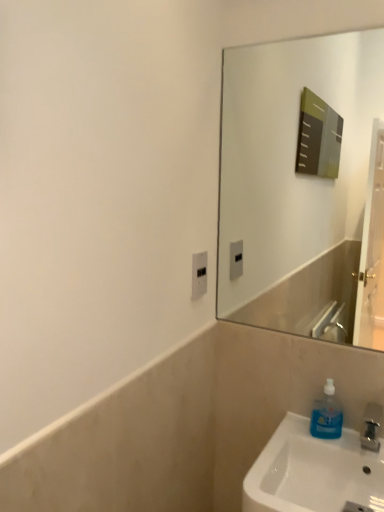
The width and height of the screenshot is (384, 512). Find the location of `white plastic electric outlet at center`. white plastic electric outlet at center is located at coordinates (199, 275).

What is the approximate width of white plastic electric outlet at center?

0.81 inches.

Describe the element at coordinates (199, 275) in the screenshot. Image resolution: width=384 pixels, height=512 pixels. I see `white plastic electric outlet at center` at that location.

The width and height of the screenshot is (384, 512). Describe the element at coordinates (327, 415) in the screenshot. I see `blue translucent soap dispenser at lower right` at that location.

In order to face blue translucent soap dispenser at lower right, should I rotate leftwards or rightwards?

You should rotate right by 17.493 degrees.

Locate an element on the screen. The height and width of the screenshot is (512, 384). blue translucent soap dispenser at lower right is located at coordinates (327, 415).

This screenshot has width=384, height=512. In order to click on white plastic electric outlet at center in this screenshot , I will do `click(199, 275)`.

Which is more to the right, blue translucent soap dispenser at lower right or white plastic electric outlet at center?

Positioned to the right is blue translucent soap dispenser at lower right.

Based on the photo, is blue translucent soap dispenser at lower right positioned before white plastic electric outlet at center?

Yes, blue translucent soap dispenser at lower right is closer to the viewer.

Is point (325, 402) farther from viewer compared to point (202, 287)?

No, it is in front of (202, 287).

From the image's perspective, is blue translucent soap dispenser at lower right positioned above or below white plastic electric outlet at center?

Based on their image positions, blue translucent soap dispenser at lower right is located beneath white plastic electric outlet at center.

From a real-world perspective, is blue translucent soap dispenser at lower right above or below white plastic electric outlet at center?

blue translucent soap dispenser at lower right is situated lower than white plastic electric outlet at center in the real world.

Which object is thinner, blue translucent soap dispenser at lower right or white plastic electric outlet at center?

With smaller width is white plastic electric outlet at center.

Does blue translucent soap dispenser at lower right have a lesser height compared to white plastic electric outlet at center?

No, blue translucent soap dispenser at lower right is not shorter than white plastic electric outlet at center.

Which of these two, blue translucent soap dispenser at lower right or white plastic electric outlet at center, is smaller?

With smaller size is white plastic electric outlet at center.

Would you say blue translucent soap dispenser at lower right is outside white plastic electric outlet at center?

Indeed, blue translucent soap dispenser at lower right is completely outside white plastic electric outlet at center.

Is blue translucent soap dispenser at lower right directly adjacent to white plastic electric outlet at center?

No, blue translucent soap dispenser at lower right is not with white plastic electric outlet at center.

From the picture: Is blue translucent soap dispenser at lower right oriented towards white plastic electric outlet at center?

No, blue translucent soap dispenser at lower right is not facing towards white plastic electric outlet at center.

How far apart are blue translucent soap dispenser at lower right and white plastic electric outlet at center?

A distance of 20.63 inches exists between blue translucent soap dispenser at lower right and white plastic electric outlet at center.

This screenshot has width=384, height=512. Identify the location of soap dispenser below the white plastic electric outlet at center (from a real-world perspective). (327, 415).

Does white plastic electric outlet at center appear on the left side of blue translucent soap dispenser at lower right?

Yes, white plastic electric outlet at center is to the left of blue translucent soap dispenser at lower right.

Based on the photo, which is behind, white plastic electric outlet at center or blue translucent soap dispenser at lower right?

white plastic electric outlet at center.

Does point (199, 259) appear closer or farther from the camera than point (313, 412)?

Point (199, 259) is positioned farther from the camera compared to point (313, 412).

From the image's perspective, which one is positioned lower, white plastic electric outlet at center or blue translucent soap dispenser at lower right?

blue translucent soap dispenser at lower right appears lower in the image.

From a real-world perspective, which is physically above, white plastic electric outlet at center or blue translucent soap dispenser at lower right?

white plastic electric outlet at center, from a real-world perspective.

Considering the sizes of objects white plastic electric outlet at center and blue translucent soap dispenser at lower right in the image provided, who is thinner, white plastic electric outlet at center or blue translucent soap dispenser at lower right?

Thinner between the two is white plastic electric outlet at center.

Who is taller, white plastic electric outlet at center or blue translucent soap dispenser at lower right?

Standing taller between the two is blue translucent soap dispenser at lower right.

Who is bigger, white plastic electric outlet at center or blue translucent soap dispenser at lower right?

blue translucent soap dispenser at lower right is bigger.

Could blue translucent soap dispenser at lower right be considered to be inside white plastic electric outlet at center?

No, blue translucent soap dispenser at lower right is located outside of white plastic electric outlet at center.

Are white plastic electric outlet at center and blue translucent soap dispenser at lower right far apart?

No, white plastic electric outlet at center is in close proximity to blue translucent soap dispenser at lower right.

Is blue translucent soap dispenser at lower right at the back of white plastic electric outlet at center?

No, white plastic electric outlet at center is not facing away from blue translucent soap dispenser at lower right.

How different are the orientations of white plastic electric outlet at center and blue translucent soap dispenser at lower right in degrees?

white plastic electric outlet at center and blue translucent soap dispenser at lower right are facing 89.5 degrees away from each other.

Locate an element on the screen. This screenshot has height=512, width=384. electric outlet that appears on the left of blue translucent soap dispenser at lower right is located at coordinates click(x=199, y=275).

This screenshot has width=384, height=512. What are the coordinates of `electric outlet that appears on the left of blue translucent soap dispenser at lower right` in the screenshot? It's located at (199, 275).

The width and height of the screenshot is (384, 512). What are the coordinates of `electric outlet behind the blue translucent soap dispenser at lower right` in the screenshot? It's located at (199, 275).